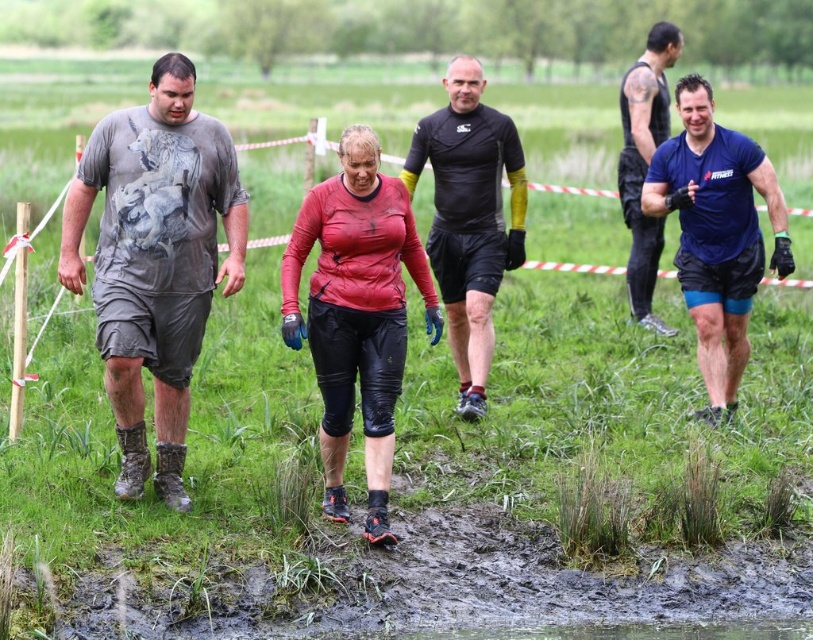
Is red matte leggings at center below blue matte t-shirt at upper right?

Yes, red matte leggings at center is below blue matte t-shirt at upper right.

Between red matte leggings at center and blue matte t-shirt at upper right, which one is positioned higher?

blue matte t-shirt at upper right

Describe the element at coordinates (355, 314) in the screenshot. The height and width of the screenshot is (640, 813). I see `red matte leggings at center` at that location.

Find the location of a particular element. red matte leggings at center is located at coordinates (355, 314).

Does dirty gray shorts at left appear on the left side of blue matte t-shirt at upper right?

Indeed, dirty gray shorts at left is positioned on the left side of blue matte t-shirt at upper right.

Does dirty gray shorts at left appear over blue matte t-shirt at upper right?

No, dirty gray shorts at left is not above blue matte t-shirt at upper right.

Between point (120, 305) and point (631, 300), which one is positioned behind?

The point (631, 300) is more distant.

Where is `dirty gray shorts at left`? This screenshot has height=640, width=813. dirty gray shorts at left is located at coordinates (155, 260).

Can you confirm if blue matte shirt at right is taller than blue matte t-shirt at upper right?

No.

Does point (781, 230) lie behind point (633, 256)?

No, (781, 230) is closer to viewer.

Where is `blue matte shirt at right`? This screenshot has width=813, height=640. blue matte shirt at right is located at coordinates (716, 234).